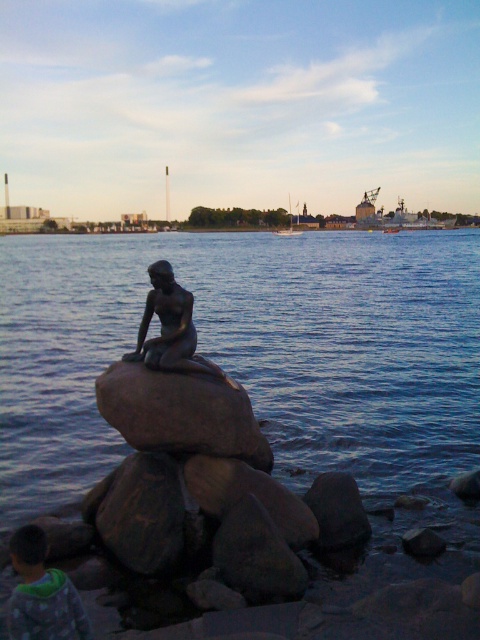
Does brown rough rock at center appear on the left side of bronze statue at center?

In fact, brown rough rock at center is to the right of bronze statue at center.

Does brown rough rock at center appear under bronze statue at center?

Indeed, brown rough rock at center is positioned under bronze statue at center.

Where is `brown rough rock at center`? This screenshot has width=480, height=640. brown rough rock at center is located at coordinates (180, 413).

Does camouflage-patterned shirt at lower left appear under bronze statue at center?

Correct, camouflage-patterned shirt at lower left is located below bronze statue at center.

Which is in front, point (12, 538) or point (181, 321)?

Point (12, 538) is in front.

Locate an element on the screen. The width and height of the screenshot is (480, 640). camouflage-patterned shirt at lower left is located at coordinates (41, 593).

Based on the photo, does blue water at center appear on the left side of camouflage-patterned shirt at lower left?

Correct, you'll find blue water at center to the left of camouflage-patterned shirt at lower left.

Can you confirm if blue water at center is shorter than camouflage-patterned shirt at lower left?

Incorrect, blue water at center's height does not fall short of camouflage-patterned shirt at lower left's.

Who is more distant from viewer, (24, 364) or (26, 540)?

Positioned behind is point (24, 364).

The width and height of the screenshot is (480, 640). I want to click on blue water at center, so click(x=250, y=349).